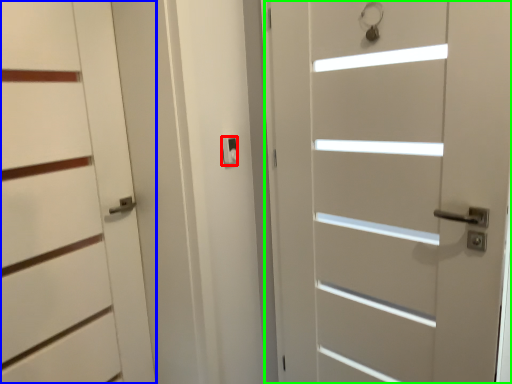
Question: Which is farther away from latch (highlighted by a red box)? door (highlighted by a blue box) or door (highlighted by a green box)?

Choices:
 (A) door
 (B) door

Answer: (B)